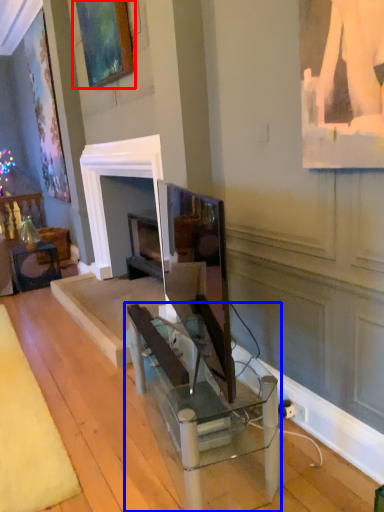
Question: Which object is closer to the camera taking this photo, picture frame (highlighted by a red box) or table (highlighted by a blue box)?

Choices:
 (A) picture frame
 (B) table

Answer: (B)